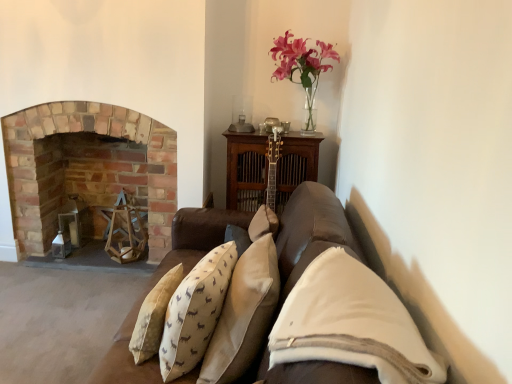
This screenshot has height=384, width=512. In order to click on beige velvet pillow at center, the first pillow viewed from the left in this screenshot , I will do `click(195, 312)`.

Where is `beige velvet pillow at center, positioned as the third pillow in right-to-left order`? The width and height of the screenshot is (512, 384). beige velvet pillow at center, positioned as the third pillow in right-to-left order is located at coordinates (195, 312).

In the image, is beige velvet pillow at center, the first pillow viewed from the left, positioned in front of or behind brick fireplace at left?

Clearly, beige velvet pillow at center, the first pillow viewed from the left, is in front of brick fireplace at left.

Can you confirm if beige velvet pillow at center, the first pillow viewed from the left, is taller than brick fireplace at left?

No, beige velvet pillow at center, the first pillow viewed from the left, is not taller than brick fireplace at left.

Is beige velvet pillow at center, positioned as the third pillow in right-to-left order, oriented away from brick fireplace at left?

No, brick fireplace at left is not at the back of beige velvet pillow at center, positioned as the third pillow in right-to-left order.

Consider the image. From the image's perspective, is beige velvet pillow at center, positioned as the third pillow in right-to-left order, located beneath brick fireplace at left?

Yes.

Can you see white soft pillow at center, the third pillow viewed from the left, touching pink glass vase at upper center?

No, white soft pillow at center, the third pillow viewed from the left, is not with pink glass vase at upper center.

Where is `floral arrangement that is above the white soft pillow at center, which is the 1th pillow in right-to-left order (from a real-world perspective)`? floral arrangement that is above the white soft pillow at center, which is the 1th pillow in right-to-left order (from a real-world perspective) is located at coordinates (302, 66).

How different are the orientations of white soft pillow at center, the third pillow viewed from the left, and pink glass vase at upper center in degrees?

The angle between the facing direction of white soft pillow at center, the third pillow viewed from the left, and the facing direction of pink glass vase at upper center is 87.6 degrees.

From the image's perspective, does white soft pillow at center, the third pillow viewed from the left, appear higher than pink glass vase at upper center?

No, from the image's perspective, white soft pillow at center, the third pillow viewed from the left, is not above pink glass vase at upper center.

Find the location of a particular element. This screenshot has height=384, width=512. fireplace that is on the left side of beige cotton pillow at center, which is the 2th pillow in right-to-left order is located at coordinates (88, 169).

From the image's perspective, which is above, beige cotton pillow at center, placed as the second pillow when sorted from left to right, or brick fireplace at left?

brick fireplace at left appears higher in the image.

Is beige cotton pillow at center, which is the 2th pillow in right-to-left order, situated inside brick fireplace at left or outside?

beige cotton pillow at center, which is the 2th pillow in right-to-left order, is outside brick fireplace at left.

From a real-world perspective, is beige cotton pillow at center, placed as the second pillow when sorted from left to right, located beneath brick fireplace at left?

Actually, beige cotton pillow at center, placed as the second pillow when sorted from left to right, is physically above brick fireplace at left in the real world.

Can you confirm if beige cotton pillow at center, placed as the second pillow when sorted from left to right, is smaller than white soft pillow at center, the third pillow viewed from the left?

Incorrect, beige cotton pillow at center, placed as the second pillow when sorted from left to right, is not smaller in size than white soft pillow at center, the third pillow viewed from the left.

From a real-world perspective, who is located lower, beige cotton pillow at center, which is the 2th pillow in right-to-left order, or white soft pillow at center, which is the 1th pillow in right-to-left order?

In real-world perspective, beige cotton pillow at center, which is the 2th pillow in right-to-left order, is lower.

How many degrees apart are the facing directions of beige cotton pillow at center, which is the 2th pillow in right-to-left order, and white soft pillow at center, the third pillow viewed from the left?

2.4 degrees separate the facing orientations of beige cotton pillow at center, which is the 2th pillow in right-to-left order, and white soft pillow at center, the third pillow viewed from the left.

From the picture: Are brick fireplace at left and pink glass vase at upper center far apart?

Yes, brick fireplace at left is far from pink glass vase at upper center.

Is brick fireplace at left oriented away from pink glass vase at upper center?

No, brick fireplace at left is not facing away from pink glass vase at upper center.

From the image's perspective, which one is positioned lower, brick fireplace at left or pink glass vase at upper center?

brick fireplace at left appears lower in the image.

Considering the positions of objects brick fireplace at left and pink glass vase at upper center in the image provided, who is more to the right, brick fireplace at left or pink glass vase at upper center?

pink glass vase at upper center.

From the image's perspective, relative to beige cotton pillow at center, placed as the second pillow when sorted from left to right, is white soft pillow at center, which is the 1th pillow in right-to-left order, above or below?

Based on their image positions, white soft pillow at center, which is the 1th pillow in right-to-left order, is located above beige cotton pillow at center, placed as the second pillow when sorted from left to right.

Is white soft pillow at center, the third pillow viewed from the left, shorter than beige cotton pillow at center, placed as the second pillow when sorted from left to right?

Correct, white soft pillow at center, the third pillow viewed from the left, is not as tall as beige cotton pillow at center, placed as the second pillow when sorted from left to right.

Does white soft pillow at center, the third pillow viewed from the left, have a smaller size compared to beige cotton pillow at center, which is the 2th pillow in right-to-left order?

Indeed, white soft pillow at center, the third pillow viewed from the left, has a smaller size compared to beige cotton pillow at center, which is the 2th pillow in right-to-left order.

At what (x,y) coordinates should I click in order to perform the action: click on pillow on the right side of beige cotton pillow at center, placed as the second pillow when sorted from left to right. Please return your answer as a coordinate pair (x, y). Looking at the image, I should click on (351, 323).

Is pink glass vase at upper center positioned with its back to white soft pillow at center, which is the 1th pillow in right-to-left order?

pink glass vase at upper center does not have its back to white soft pillow at center, which is the 1th pillow in right-to-left order.

Can you confirm if pink glass vase at upper center is taller than white soft pillow at center, which is the 1th pillow in right-to-left order?

Yes.

Can you tell me how much pink glass vase at upper center and white soft pillow at center, the third pillow viewed from the left, differ in facing direction?

They differ by 87.6 degrees in their facing directions.

Is pink glass vase at upper center next to white soft pillow at center, which is the 1th pillow in right-to-left order?

pink glass vase at upper center and white soft pillow at center, which is the 1th pillow in right-to-left order, are not in contact.

Identify the location of fireplace above the beige velvet pillow at center, the first pillow viewed from the left (from the image's perspective). This screenshot has height=384, width=512. (88, 169).

Image resolution: width=512 pixels, height=384 pixels. What are the coordinates of `floral arrangement located above the white soft pillow at center, which is the 1th pillow in right-to-left order (from a real-world perspective)` in the screenshot? It's located at (302, 66).

In the scene shown: Based on their spatial positions, is white soft pillow at center, which is the 1th pillow in right-to-left order, or brick fireplace at left further from beige velvet pillow at center, the first pillow viewed from the left?

brick fireplace at left is further to beige velvet pillow at center, the first pillow viewed from the left.

Estimate the real-world distances between objects in this image. Which object is further from brick fireplace at left, beige cotton pillow at center, placed as the second pillow when sorted from left to right, or beige velvet pillow at center, positioned as the third pillow in right-to-left order?

The object further to brick fireplace at left is beige cotton pillow at center, placed as the second pillow when sorted from left to right.

From the image, which object appears to be nearer to beige cotton pillow at center, which is the 2th pillow in right-to-left order, pink glass vase at upper center or white soft pillow at center, which is the 1th pillow in right-to-left order?

Based on the image, white soft pillow at center, which is the 1th pillow in right-to-left order, appears to be nearer to beige cotton pillow at center, which is the 2th pillow in right-to-left order.

When comparing their distances from beige velvet pillow at center, positioned as the third pillow in right-to-left order, does white soft pillow at center, the third pillow viewed from the left, or beige cotton pillow at center, placed as the second pillow when sorted from left to right, seem closer?

beige cotton pillow at center, placed as the second pillow when sorted from left to right.

Looking at the image, which one is located further to beige velvet pillow at center, the first pillow viewed from the left, brick fireplace at left or pink glass vase at upper center?

brick fireplace at left lies further to beige velvet pillow at center, the first pillow viewed from the left, than the other object.

Estimate the real-world distances between objects in this image. Which object is further from brick fireplace at left, beige cotton pillow at center, placed as the second pillow when sorted from left to right, or pink glass vase at upper center?

beige cotton pillow at center, placed as the second pillow when sorted from left to right.

From the image, which object appears to be nearer to pink glass vase at upper center, brick fireplace at left or beige cotton pillow at center, which is the 2th pillow in right-to-left order?

Based on the image, brick fireplace at left appears to be nearer to pink glass vase at upper center.

Based on the photo, when comparing their distances from white soft pillow at center, the third pillow viewed from the left, does beige velvet pillow at center, positioned as the third pillow in right-to-left order, or brick fireplace at left seem further?

brick fireplace at left lies further to white soft pillow at center, the third pillow viewed from the left, than the other object.

The image size is (512, 384). Find the location of `floral arrangement positioned between white soft pillow at center, the third pillow viewed from the left, and brick fireplace at left from near to far`. floral arrangement positioned between white soft pillow at center, the third pillow viewed from the left, and brick fireplace at left from near to far is located at coordinates (302, 66).

Where is `floral arrangement between beige velvet pillow at center, the first pillow viewed from the left, and brick fireplace at left, along the z-axis`? floral arrangement between beige velvet pillow at center, the first pillow viewed from the left, and brick fireplace at left, along the z-axis is located at coordinates (302, 66).

You are a GUI agent. You are given a task and a screenshot of the screen. Output one action in this format:
    pyautogui.click(x=<x>, y=<y>)
    Task: Click on the floral arrangement between beige cotton pillow at center, placed as the second pillow when sorted from left to right, and brick fireplace at left from front to back
    The image size is (512, 384).
    Given the screenshot: What is the action you would take?
    pyautogui.click(x=302, y=66)

Where is `pillow between beige cotton pillow at center, placed as the second pillow when sorted from left to right, and pink glass vase at upper center from front to back`? This screenshot has width=512, height=384. pillow between beige cotton pillow at center, placed as the second pillow when sorted from left to right, and pink glass vase at upper center from front to back is located at coordinates (195, 312).